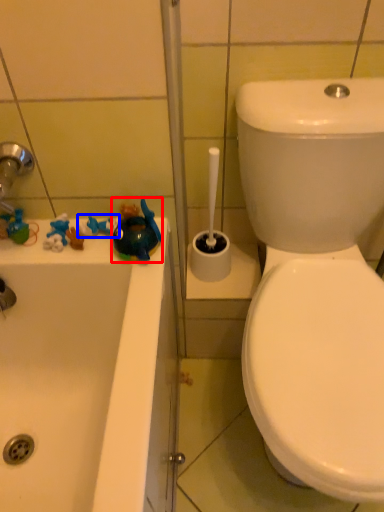
Question: Which object is further to the camera taking this photo, toy (highlighted by a red box) or toy (highlighted by a blue box)?

Choices:
 (A) toy
 (B) toy

Answer: (B)